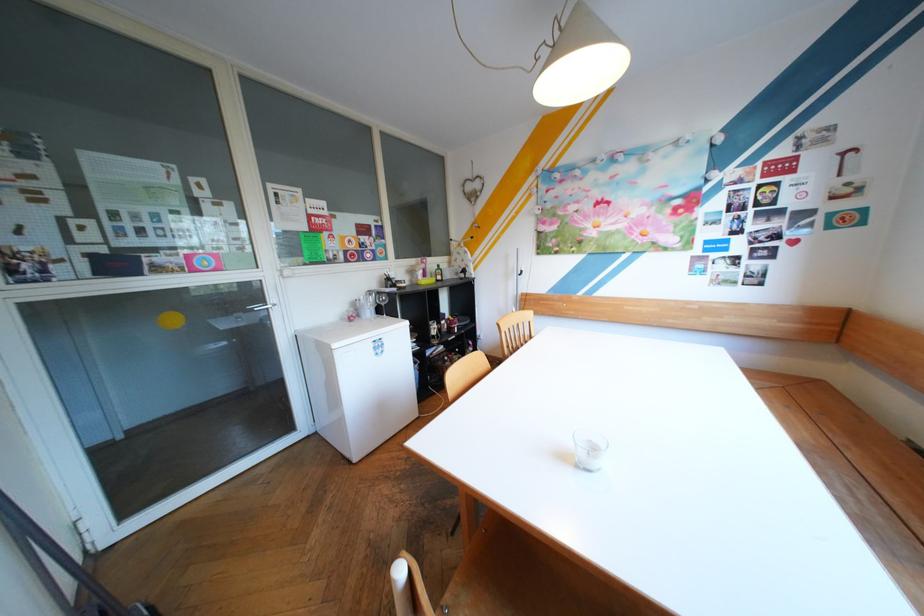
Image resolution: width=924 pixels, height=616 pixels. Identify the location of freezer lid. (351, 330).